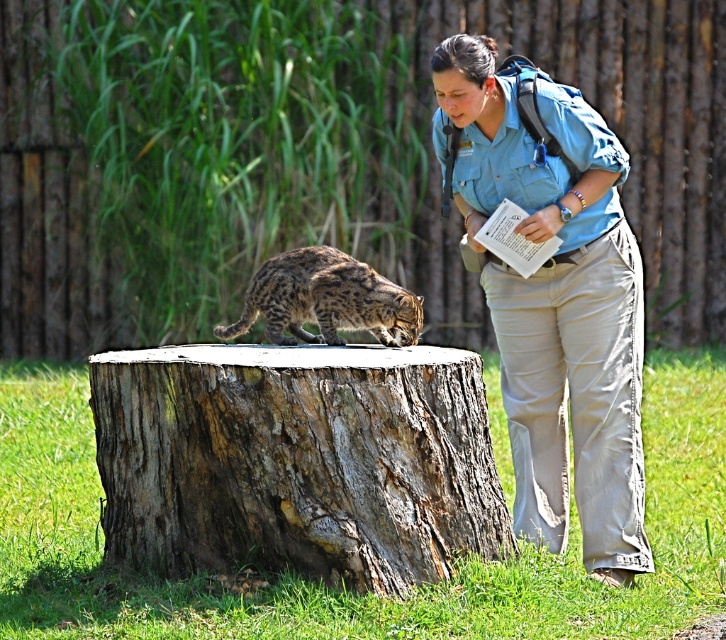
You are a park ranger who needs to locate the blue uniform at center in a naturalistic enclosure. According to the coordinates provided, where would you find it?

The blue uniform at center is located at coordinates point (554,296).

You are a wildlife photographer aiming to capture a photo of the spotted fur cat at center. To ensure the cat is the main focus, you need to adjust your camera settings so that the rough bark tree stump at center does not overshadow it in size. Based on the scene description, what adjustment should you make?

The rough bark tree stump at center is taller than the spotted fur cat at center. To make the cat the main focus, you should position yourself closer to the spotted fur cat at center to reduce the apparent size difference between the two, ensuring the cat appears larger in the frame compared to the stump.

You are a wildlife photographer standing at the camera position. You want to capture a closeup shot of the wild cat on the rough bark tree stump at center. Given that your camera can focus on subjects within 5 meters, will you be able to take the photo without moving closer?

The rough bark tree stump at center is 5.58 meters away from the camera, which is beyond the 5 meter focusing range. Therefore, you cannot take a closeup shot without moving closer.